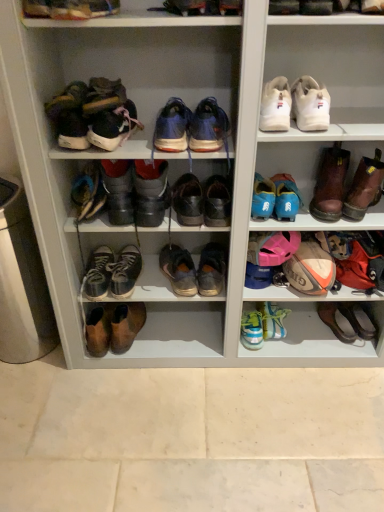
Question: In terms of width, does shiny blue sneakers at center, arranged as the 6th footwear when viewed from the right, look wider or thinner when compared to leather shoes at center, which appears as the 7th footwear when viewed from the right?

Choices:
 (A) thin
 (B) wide

Answer: (A)

Question: Is shiny blue sneakers at center, placed as the sixth footwear when sorted from left to right, in front of or behind leather shoes at center, acting as the 5th footwear starting from the left, in the image?

Choices:
 (A) behind
 (B) front

Answer: (B)

Question: Based on their relative distances, which object is nearer to the leather at center, the sixth shoe when ordered from left to right?

Choices:
 (A) blue suede sneakers at center, the fourth footwear in the right-to-left sequence
 (B) leather shoes at center, which appears as the 3th footwear when viewed from the left
 (C) leather boots at center, the 2th footwear in the left-to-right sequence
 (D) leather shoes at center, which appears as the 7th footwear when viewed from the right
 (E) leather shoes at center, positioned as the 8th shoe in right-to-left order

Answer: (D)

Question: Which of these objects is positioned farthest from the worn leather shoes at center, placed as the 7th footwear when sorted from left to right?

Choices:
 (A) worn leather shoes at center, which is the 5th shoe in right-to-left order
 (B) light blue synthetic sneakers at lower center, arranged as the 3th shoe when viewed from the right
 (C) leather boots at upper left, which is the 9th shoe from right to left
 (D) shiny blue sneakers at center, placed as the sixth footwear when sorted from left to right
 (E) leather at center, which appears as the 4th shoe when viewed from the right

Answer: (C)